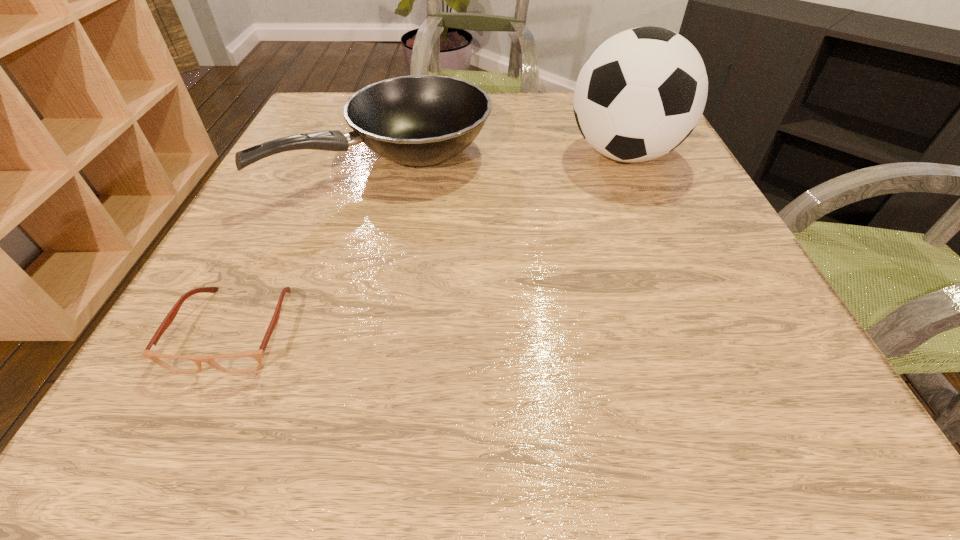
Locate an element on the screen. object that ranks as the closest to the frying pan is located at coordinates (641, 93).

Image resolution: width=960 pixels, height=540 pixels. In order to click on object that stands as the closest to the second tallest object in this screenshot , I will do (641, 93).

Identify the location of vacant space that satisfies the following two spatial constraints: 1. on the back side of the rightmost object; 2. on the right side of the second tallest object. Image resolution: width=960 pixels, height=540 pixels. (388, 154).

This screenshot has height=540, width=960. I want to click on free space that satisfies the following two spatial constraints: 1. on the back side of the rightmost object; 2. on the left side of the frying pan, so click(388, 154).